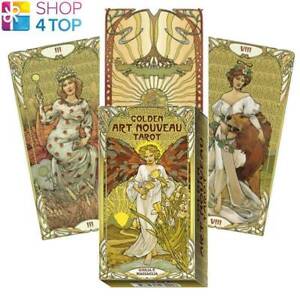
This screenshot has height=300, width=300. I want to click on box that holds the tarot cards, so click(x=191, y=226).